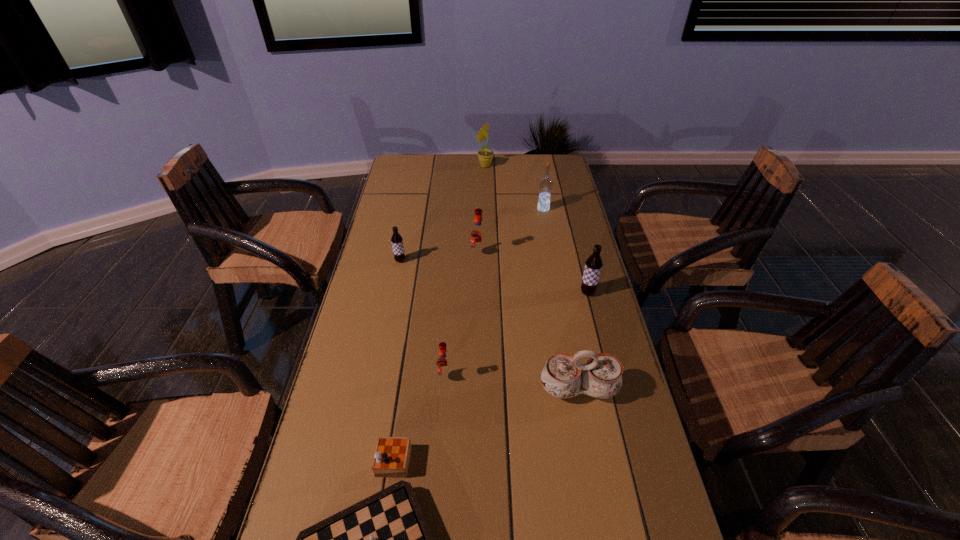
In order to click on vacant region located 0.120m on the front of the farther brown root beer in this screenshot , I will do `click(395, 290)`.

Image resolution: width=960 pixels, height=540 pixels. In order to click on vacant space located 0.240m on the back of the nearest root beer in this screenshot , I will do `click(450, 305)`.

Image resolution: width=960 pixels, height=540 pixels. In order to click on object that is at the far edge in this screenshot , I will do `click(485, 156)`.

Where is `object at the left edge`? object at the left edge is located at coordinates (397, 241).

Where is `vodka at the right edge`? vodka at the right edge is located at coordinates (546, 183).

I want to click on root beer that is at the right edge, so click(593, 265).

You are a GUI agent. You are given a task and a screenshot of the screen. Output one action in this format:
    pyautogui.click(x=<x>, y=<y>)
    Task: Click on the chinaware that is positioned at the right edge
    
    Given the screenshot: What is the action you would take?
    pyautogui.click(x=563, y=375)

Find the location of a particular element. The width and height of the screenshot is (960, 540). vacant area at the far edge of the desktop is located at coordinates (524, 154).

I want to click on free region at the left edge, so click(x=386, y=191).

The width and height of the screenshot is (960, 540). Find the location of `free region at the right edge of the desktop`. free region at the right edge of the desktop is located at coordinates (621, 440).